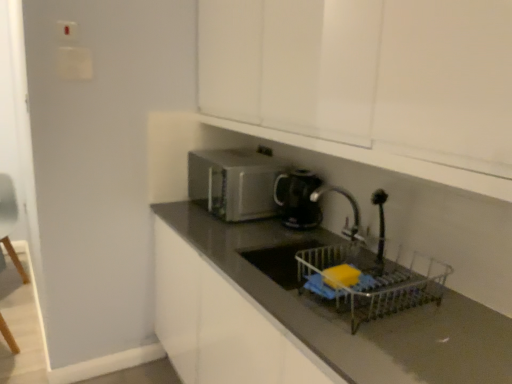
Question: Is white glossy cabinet at upper center taller than metallic silver dish rack at lower center?

Choices:
 (A) no
 (B) yes

Answer: (B)

Question: From a real-world perspective, is white glossy cabinet at upper center on top of metallic silver dish rack at lower center?

Choices:
 (A) yes
 (B) no

Answer: (A)

Question: Can you confirm if white glossy cabinet at upper center is thinner than metallic silver dish rack at lower center?

Choices:
 (A) yes
 (B) no

Answer: (B)

Question: From a real-world perspective, is white glossy cabinet at upper center located beneath metallic silver dish rack at lower center?

Choices:
 (A) yes
 (B) no

Answer: (B)

Question: Considering the relative sizes of white glossy cabinet at upper center and metallic silver dish rack at lower center in the image provided, is white glossy cabinet at upper center wider than metallic silver dish rack at lower center?

Choices:
 (A) no
 (B) yes

Answer: (B)

Question: In terms of size, does black glossy kettle at center appear bigger or smaller than light blue fabric armchair at left?

Choices:
 (A) small
 (B) big

Answer: (A)

Question: From the image's perspective, is black glossy kettle at center positioned above or below light blue fabric armchair at left?

Choices:
 (A) above
 (B) below

Answer: (A)

Question: Is black glossy kettle at center inside the boundaries of light blue fabric armchair at left, or outside?

Choices:
 (A) inside
 (B) outside

Answer: (B)

Question: Does point (279, 200) appear closer or farther from the camera than point (10, 185)?

Choices:
 (A) closer
 (B) farther

Answer: (A)

Question: Does point (198, 210) appear closer or farther from the camera than point (206, 165)?

Choices:
 (A) farther
 (B) closer

Answer: (B)

Question: Considering the positions of black glossy countertop at center and satin silver microwave at center in the image, is black glossy countertop at center bigger or smaller than satin silver microwave at center?

Choices:
 (A) small
 (B) big

Answer: (B)

Question: In the image, is black glossy countertop at center on the left side or the right side of satin silver microwave at center?

Choices:
 (A) right
 (B) left

Answer: (A)

Question: In the image, is black glossy countertop at center positioned in front of or behind satin silver microwave at center?

Choices:
 (A) front
 (B) behind

Answer: (A)

Question: Is satin silver microwave at center in front of or behind black glossy kettle at center in the image?

Choices:
 (A) behind
 (B) front

Answer: (A)

Question: From a real-world perspective, relative to black glossy kettle at center, is satin silver microwave at center vertically above or below?

Choices:
 (A) above
 (B) below

Answer: (A)